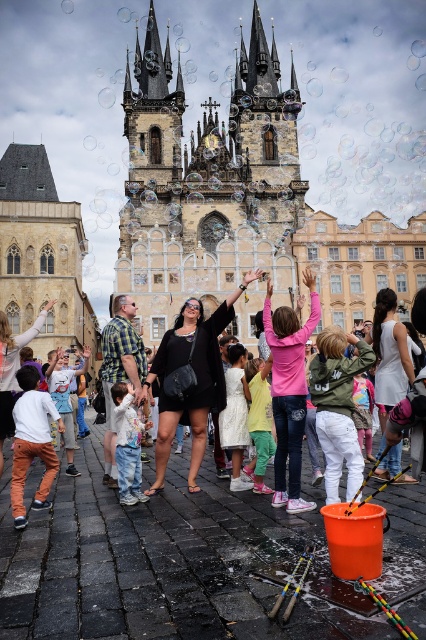
Who is more distant from viewer, (x=276, y=449) or (x=259, y=378)?

The point (x=259, y=378) is more distant.

Can you confirm if pink matte shirt at center is taller than light pink fabric dress at center?

Yes, pink matte shirt at center is taller than light pink fabric dress at center.

Does point (279, 401) come behind point (253, 403)?

No.

Image resolution: width=426 pixels, height=640 pixels. What are the coordinates of `pink matte shirt at center` in the screenshot? It's located at (288, 392).

Does point (256, 129) lie behind point (328, 496)?

Yes, it is.

Is stone gothic tower at center positioned in front of green matte jacket at center?

That is False.

Between point (261, 68) and point (362, 355), which one is positioned behind?

The point (261, 68) is behind.

I want to click on stone gothic tower at center, so click(x=207, y=180).

Find the location of `pink matte shirt at center`. pink matte shirt at center is located at coordinates (288, 392).

Which of these two, pink matte shirt at center or white matte dress at center, stands taller?

pink matte shirt at center is taller.

Who is more forward, (299, 392) or (386, 360)?

Point (299, 392) is more forward.

At what (x,y) coordinates should I click in order to perform the action: click on pink matte shirt at center. Please return your answer as a coordinate pair (x, y). Looking at the image, I should click on (288, 392).